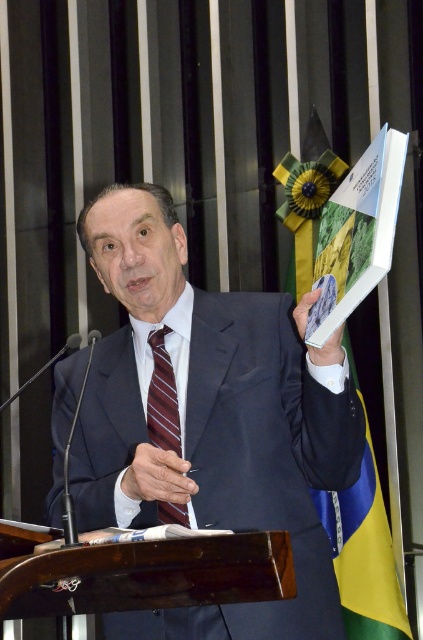
You are organizing an event and need to ensure that the speaker wearing the gray suit at center and the maroon striped tie at center can comfortably sit in a chair that is 40 cm wide. Based on the description, will the chair be wide enough?

The gray suit at center might be wider than the maroon striped tie at center, so the chair width of 40 cm may not be sufficient if the suit requires more space. It is advisable to check the actual dimensions of the suit to ensure comfort.

Based on the scene description, where is the gray suit at center located in terms of its 2D coordinates?

The gray suit at center is located at the 2D coordinates point [209,420].